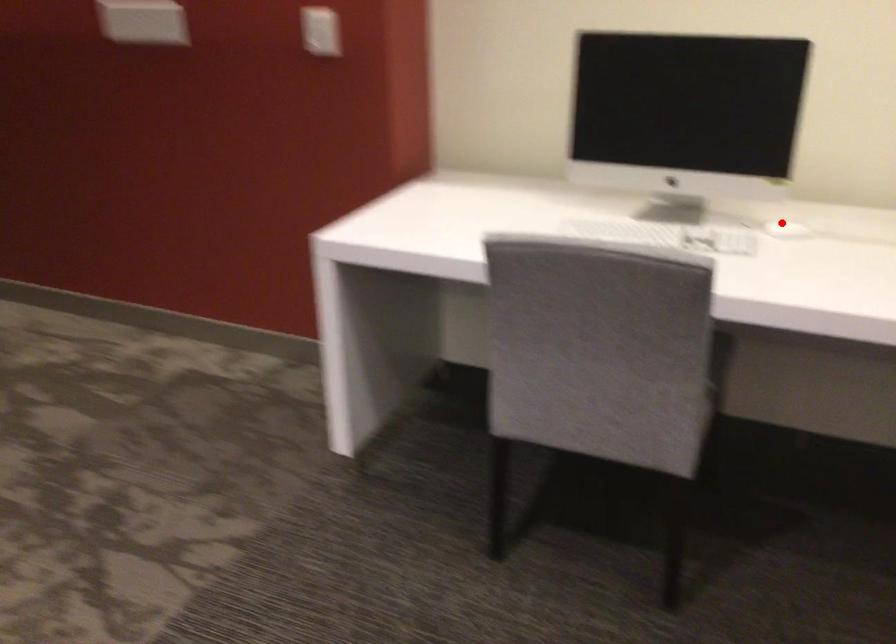
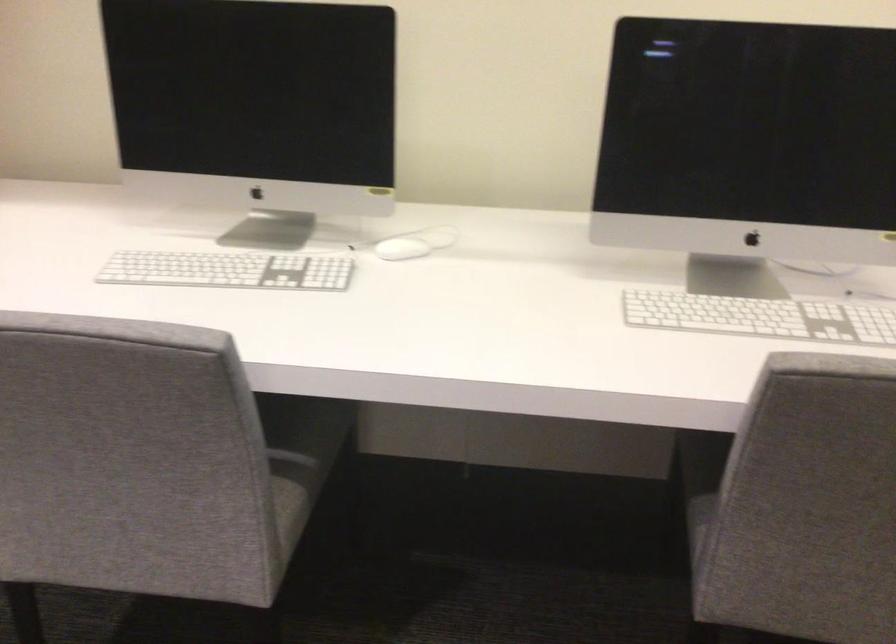
Locate, in the second image, the point that corresponds to the highlighted location in the first image.

(401, 249)